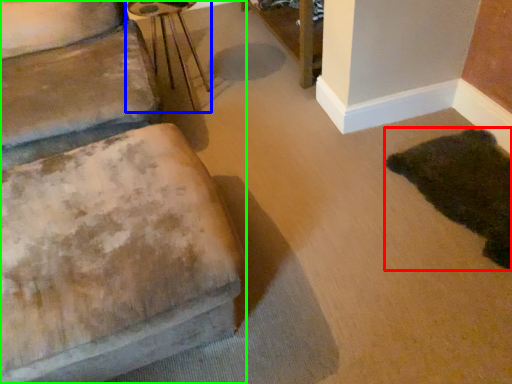
Question: Considering the real-world distances, which object is farthest from animal (highlighted by a red box)? side table (highlighted by a blue box) or furniture (highlighted by a green box)?

Choices:
 (A) side table
 (B) furniture

Answer: (A)